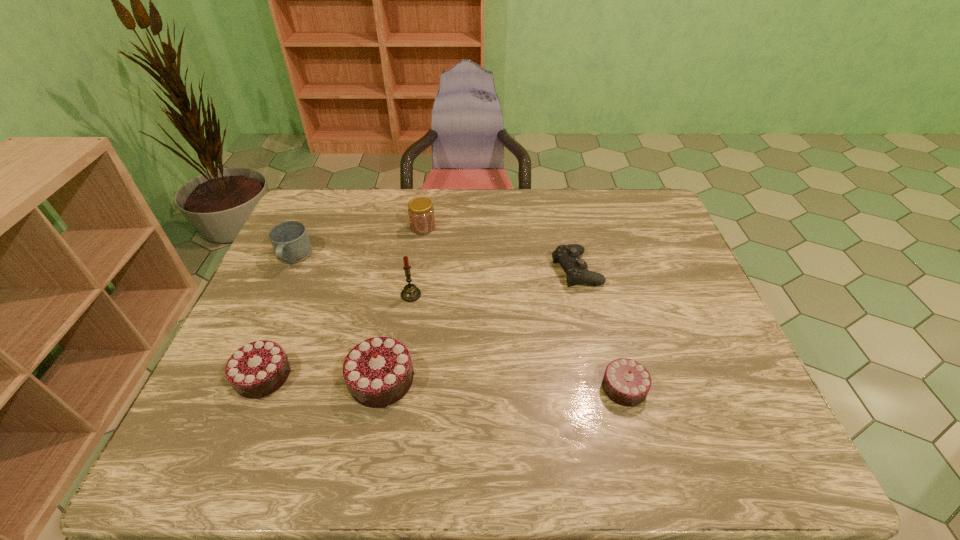
Locate an element on the screen. free spot between the candle and the control is located at coordinates (493, 282).

Where is `empty space between the leftmost chocolate cake and the jam`? This screenshot has width=960, height=540. empty space between the leftmost chocolate cake and the jam is located at coordinates (343, 302).

The height and width of the screenshot is (540, 960). In order to click on free spot between the control and the shortest chocolate cake in this screenshot , I will do `click(600, 328)`.

In order to click on vacant space that is in between the leftmost chocolate cake and the rightmost chocolate cake in this screenshot , I will do `click(444, 382)`.

Locate which object ranks sixth in proximity to the shortest chocolate cake. Please provide its 2D coordinates. Your answer should be formatted as a tuple, i.e. [(x, y)], where the tuple contains the x and y coordinates of a point satisfying the conditions above.

[(290, 241)]

You are a GUI agent. You are given a task and a screenshot of the screen. Output one action in this format:
    pyautogui.click(x=<x>, y=<y>)
    Task: Click on the object that is the second closest to the rightmost chocolate cake
    
    Given the screenshot: What is the action you would take?
    pyautogui.click(x=378, y=372)

Locate which chocolate cake is the closest to the shortest chocolate cake. Please provide its 2D coordinates. Your answer should be formatted as a tuple, i.e. [(x, y)], where the tuple contains the x and y coordinates of a point satisfying the conditions above.

[(378, 372)]

What are the coordinates of `chocolate cake object that ranks as the closest to the tallest chocolate cake` in the screenshot? It's located at (256, 370).

The height and width of the screenshot is (540, 960). I want to click on free space that satisfies the following two spatial constraints: 1. on the side of the mug with the handle; 2. on the right side of the tallest chocolate cake, so click(237, 380).

You are a GUI agent. You are given a task and a screenshot of the screen. Output one action in this format:
    pyautogui.click(x=<x>, y=<y>)
    Task: Click on the free location that satisfies the following two spatial constraints: 1. on the side of the mug with the handle; 2. on the left side of the shortest chocolate cake
    The width and height of the screenshot is (960, 540).
    Given the screenshot: What is the action you would take?
    pyautogui.click(x=233, y=388)